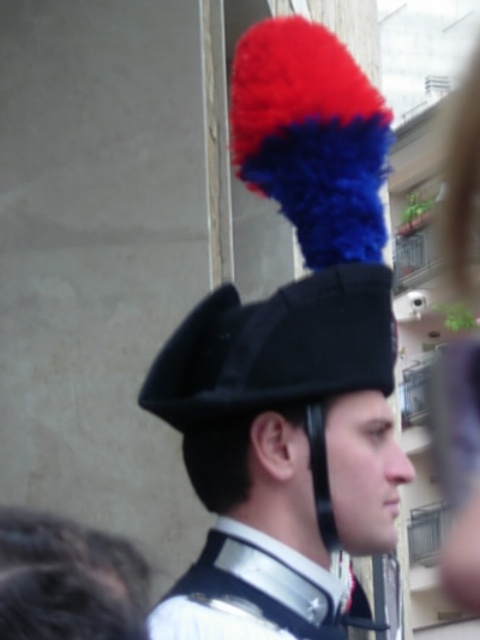
You are a tailor measuring the dimensions of the black felt hat at upper center and the white glossy uniform at center. Which item has a smaller height?

The black felt hat at upper center has a lesser height compared to the white glossy uniform at center, so the black felt hat at upper center is smaller in height.

In the scene shown: You are a photographer standing at the base of a tall building. You see the black felt hat at center and the top of the building. Which one is higher?

The top of the building is higher than the black felt hat at center because they are 30.17 meters apart.

You are a tailor measuring the black felt hat at upper center and the white glossy uniform at center for alterations. Which item has a smaller width?

The black felt hat at upper center has a smaller width than the white glossy uniform at center.